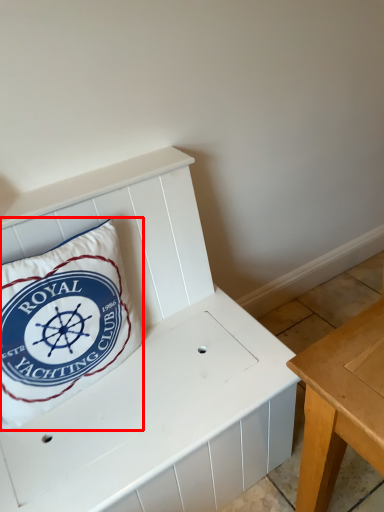
Question: Where is pillow (annotated by the red box) located in relation to furniture in the image?

Choices:
 (A) right
 (B) left

Answer: (B)